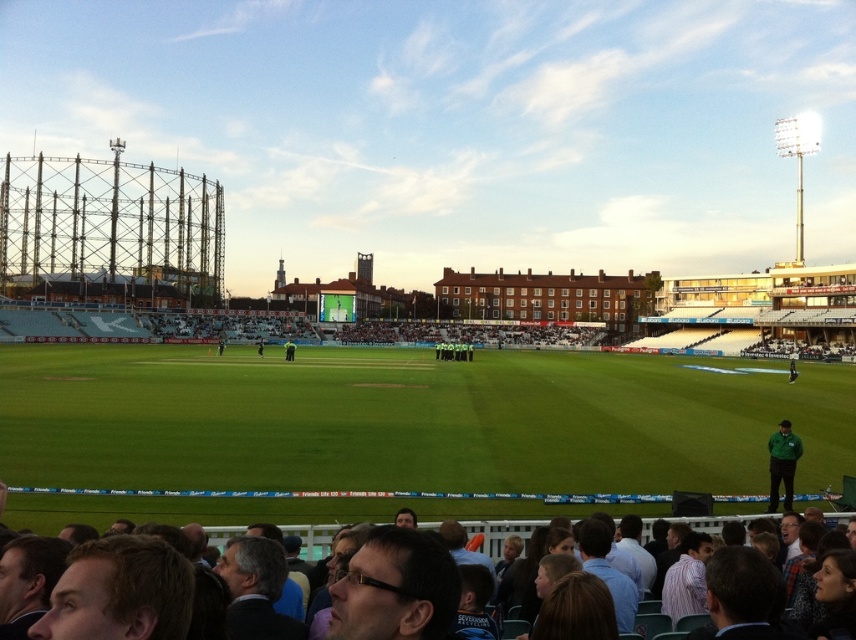
Is green grass football field at center below dark brown leather jacket at lower center?

No, green grass football field at center is not below dark brown leather jacket at lower center.

Where is `green grass football field at center`? The width and height of the screenshot is (856, 640). green grass football field at center is located at coordinates (412, 420).

Is green grass football field at center further to camera compared to green fabric jacket at lower right?

That is False.

Can you confirm if green grass football field at center is smaller than green fabric jacket at lower right?

No, green grass football field at center is not smaller than green fabric jacket at lower right.

Is point (13, 353) behind point (783, 456)?

Yes, point (13, 353) is behind point (783, 456).

Image resolution: width=856 pixels, height=640 pixels. Find the location of `green grass football field at center`. green grass football field at center is located at coordinates (412, 420).

At what (x,y) coordinates should I click in order to perform the action: click on green fabric jacket at lower right. Please return your answer as a coordinate pair (x, y). Looking at the image, I should click on (782, 464).

Between point (771, 486) and point (293, 355), which one is positioned behind?

The point (293, 355) is behind.

Find the location of a particular element. This screenshot has height=640, width=856. green fabric jacket at lower right is located at coordinates (782, 464).